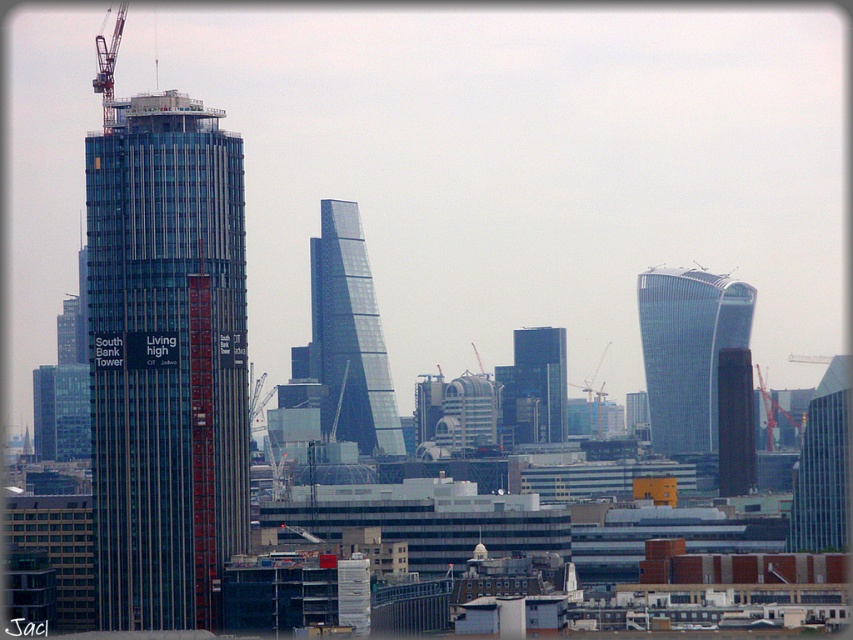
You are a drone operator tasked with capturing aerial footage of the city. You need to fly your drone from the matte glass skyscraper at center to the nearest building to the east. Which building should you fly towards?

The nearest building to the east of the matte glass skyscraper at center would be the distinctive angular structure to its right. However, since the exact coordinates are provided for the matte glass skyscraper at center, the precise direction and distance would require referencing the coordinate system given. Without additional coordinate data for other buildings, the angular structure to the right is the most logical choice based on the description.

You are an architect analyzing the cityscape. You observe the transparent glass skyscraper at center and the matte glass skyscraper at center. Which of these two buildings has a greater width?

The transparent glass skyscraper at center has a greater width than the matte glass skyscraper at center according to the description.